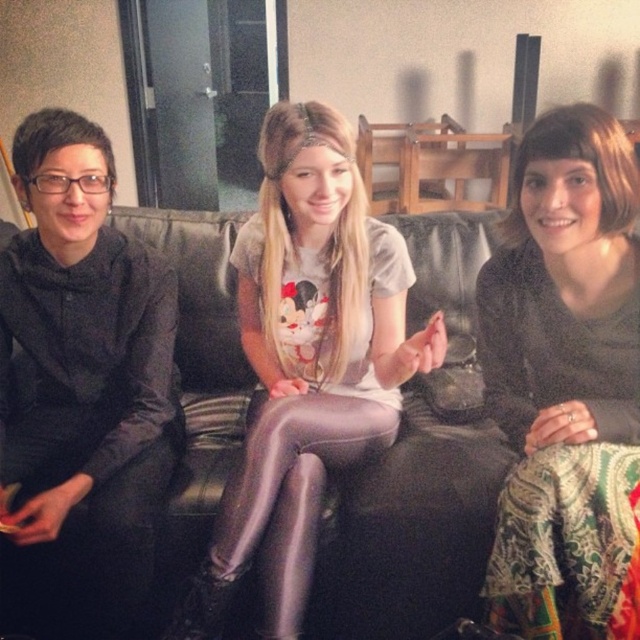
Question: From the image, what is the correct spatial relationship of black leather couch at center in relation to black textured skirt at lower right?

Choices:
 (A) below
 (B) above

Answer: (A)

Question: Which point is farther to the camera?

Choices:
 (A) black matte jacket at left
 (B) black textured skirt at lower right
 (C) matte purple leggings at center
 (D) black leather couch at center

Answer: (D)

Question: Can you confirm if black leather couch at center is positioned to the left of matte purple leggings at center?

Choices:
 (A) no
 (B) yes

Answer: (B)

Question: Is black leather couch at center above matte purple leggings at center?

Choices:
 (A) yes
 (B) no

Answer: (A)

Question: Estimate the real-world distances between objects in this image. Which object is farther from the black textured skirt at lower right?

Choices:
 (A) black leather couch at center
 (B) matte purple leggings at center

Answer: (B)

Question: Which of the following is the farthest from the observer?

Choices:
 (A) black matte jacket at left
 (B) black leather couch at center

Answer: (B)